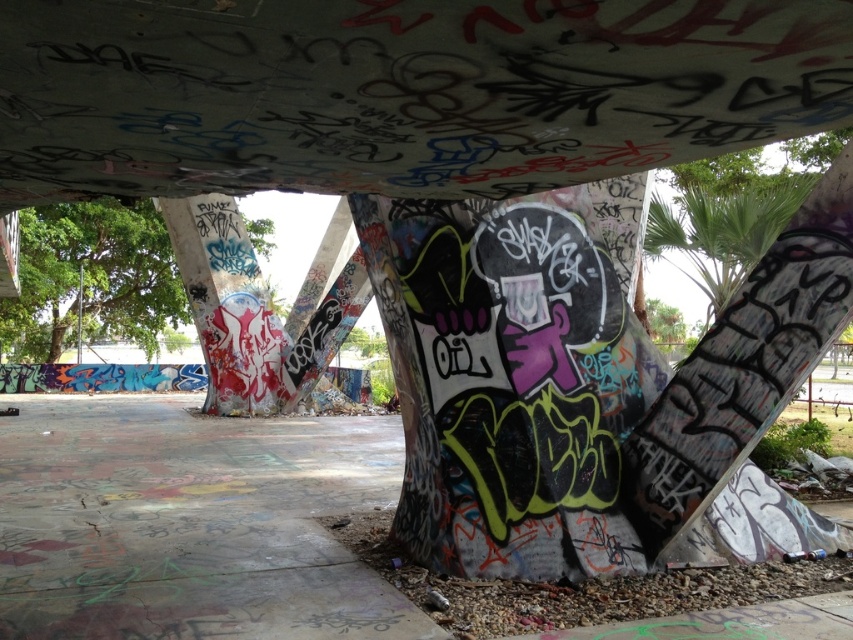
This screenshot has height=640, width=853. What do you see at coordinates (91, 278) in the screenshot? I see `green leafy tree at left` at bounding box center [91, 278].

Does green leafy tree at left have a greater width compared to green leafy tree at upper right?

Yes.

Between point (178, 305) and point (735, 280), which one is positioned in front?

Point (735, 280)

Where is `green leafy tree at left`? green leafy tree at left is located at coordinates (91, 278).

Which of these two, graffiti-covered concrete pillar at center or green leafy tree at upper right, stands shorter?

Standing shorter between the two is green leafy tree at upper right.

Can you confirm if graffiti-covered concrete pillar at center is positioned to the right of green leafy tree at upper right?

In fact, graffiti-covered concrete pillar at center is to the left of green leafy tree at upper right.

Where is `graffiti-covered concrete pillar at center`? This screenshot has width=853, height=640. graffiti-covered concrete pillar at center is located at coordinates (225, 304).

From the picture: Which is above, green leafy tree at left or graffiti-covered concrete pillar at center?

green leafy tree at left

Describe the element at coordinates (91, 278) in the screenshot. I see `green leafy tree at left` at that location.

Identify the location of green leafy tree at left. (91, 278).

The image size is (853, 640). Identify the location of green leafy tree at left. (91, 278).